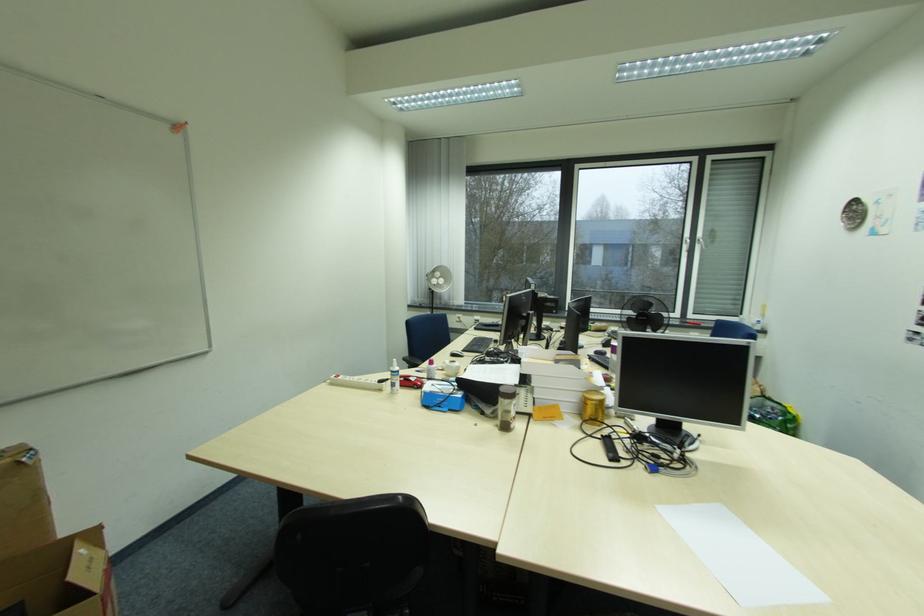
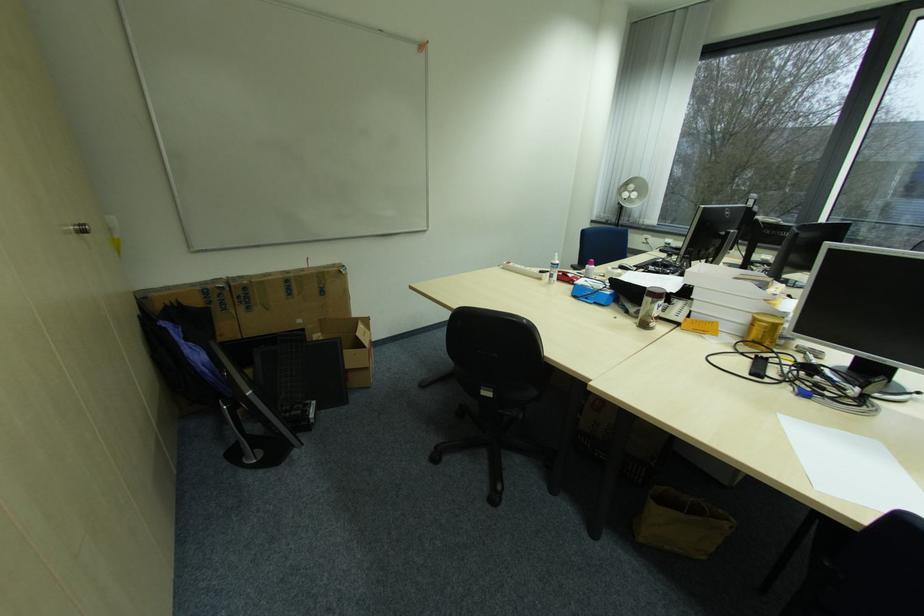
The point at (603,405) is marked in the first image. Where is the corresponding point in the second image?

(773, 329)